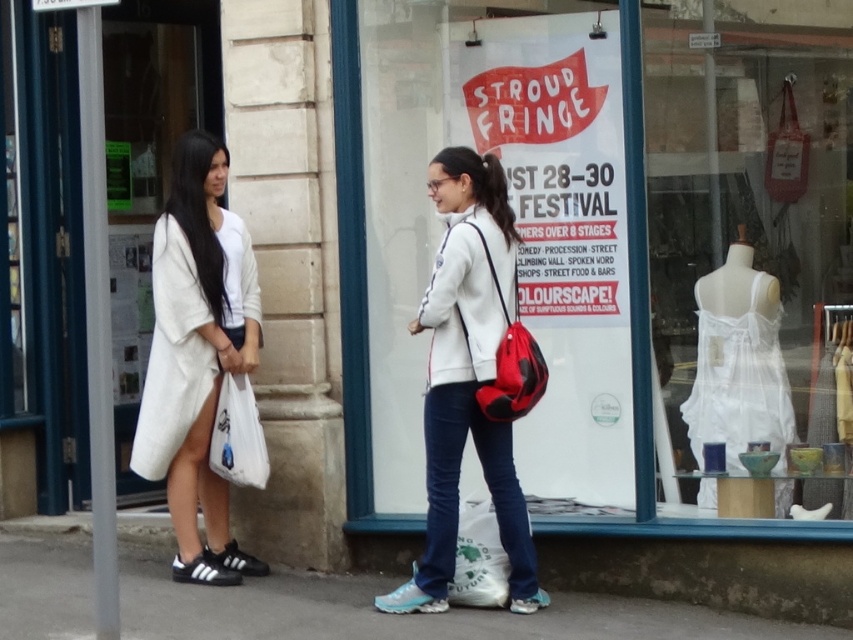
You are a fashion designer observing two items in a store window. The items are the white sheer fabric dress at right and the white matte jacket at center. Which one is positioned to the right side of the other?

The white sheer fabric dress at right is positioned to the right of the white matte jacket at center.